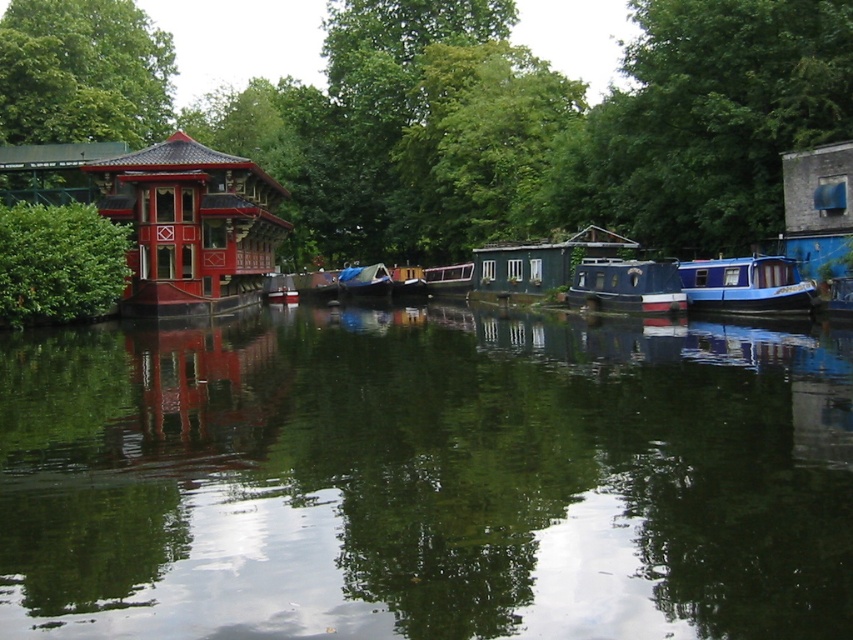
Question: Is green reflective water at center wider than green leafy tree at upper right?

Choices:
 (A) no
 (B) yes

Answer: (A)

Question: Considering the relative positions of blue glossy houseboat at right and wooden boat at center in the image provided, where is blue glossy houseboat at right located with respect to wooden boat at center?

Choices:
 (A) right
 (B) left

Answer: (A)

Question: Which of the following is the farthest from the observer?

Choices:
 (A) (236, 196)
 (B) (614, 262)

Answer: (A)

Question: Among these objects, which one is nearest to the camera?

Choices:
 (A) green leafy tree at upper right
 (B) blue glossy houseboat at center

Answer: (A)

Question: Based on their relative distances, which object is nearer to the shiny lacquered gazebo at left?

Choices:
 (A) blue glossy houseboat at right
 (B) blue glossy houseboat at center
 (C) blue polished wood boat at center
 (D) green leafy tree at upper right

Answer: (B)

Question: Can you confirm if green leafy tree at upper right is smaller than wooden cabin boat at center?

Choices:
 (A) yes
 (B) no

Answer: (B)